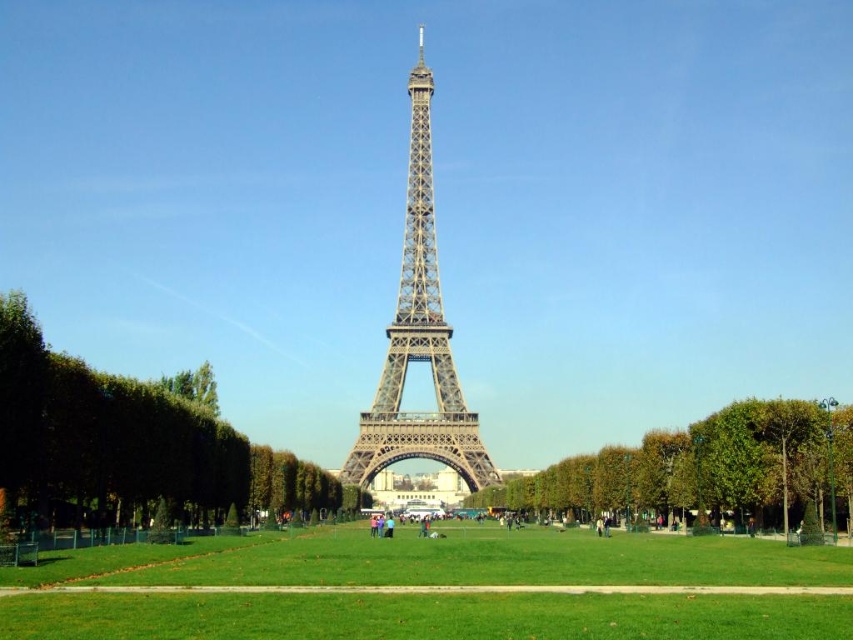
You are standing at the park near the Eiffel Tower and see the green grass at center and the green leafy tree at center. Which object is closer to the ground?

The green grass at center is located below the green leafy tree at center, so it is closer to the ground.

You are standing on the grassy area near the Eiffel Tower and want to take a photo that includes both the green leafy tree at left and the green leafy tree at center. Which tree should you position closer to the camera to ensure both are in the frame?

To include both the green leafy tree at left and the green leafy tree at center in the photo, you should position the green leafy tree at left closer to the camera since it is larger in size and will occupy more space in the frame.

You are standing at the point marked by the coordinates point (129, 445) in the image. Looking towards the Eiffel Tower, what do you see immediately in front of you?

The point (129, 445) indicates green leafy tree at left, so you would see the green leafy tree at left directly in front of you when looking toward the Eiffel Tower.